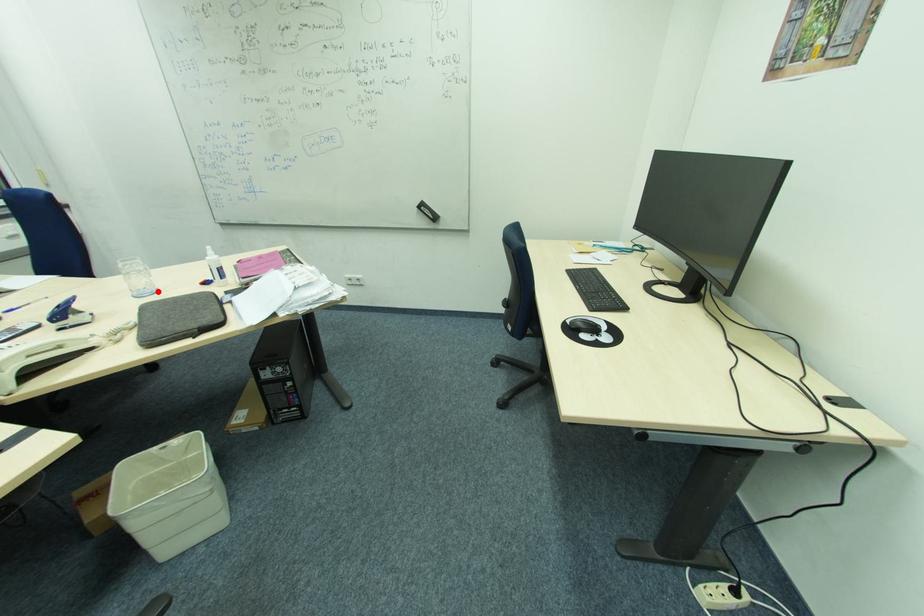
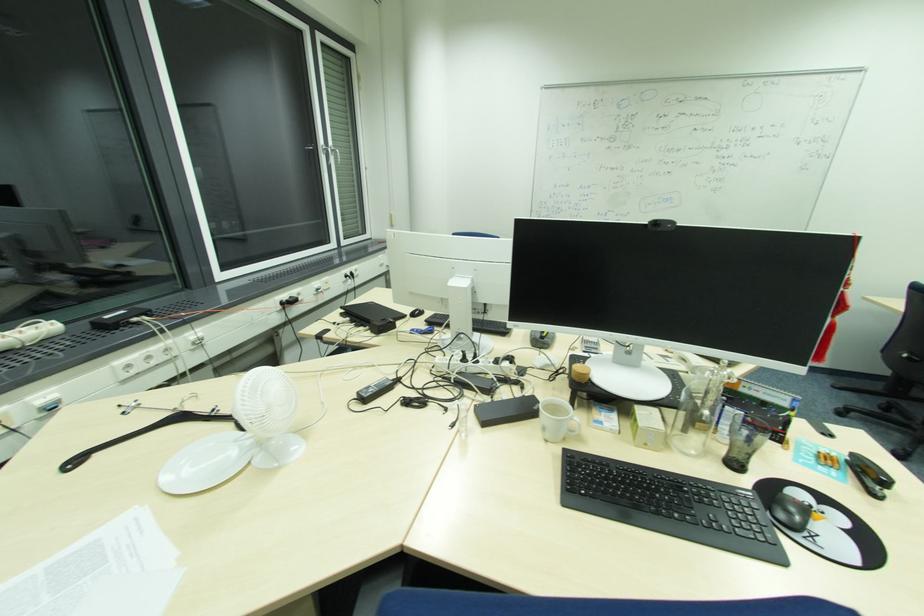
Question: I am providing you with two images of the same scene from different viewpoints. A red point is marked on the first image. At the location where the point appears in image 1, is it still visible in image 2?

Choices:
 (A) Yes
 (B) No

Answer: (B)